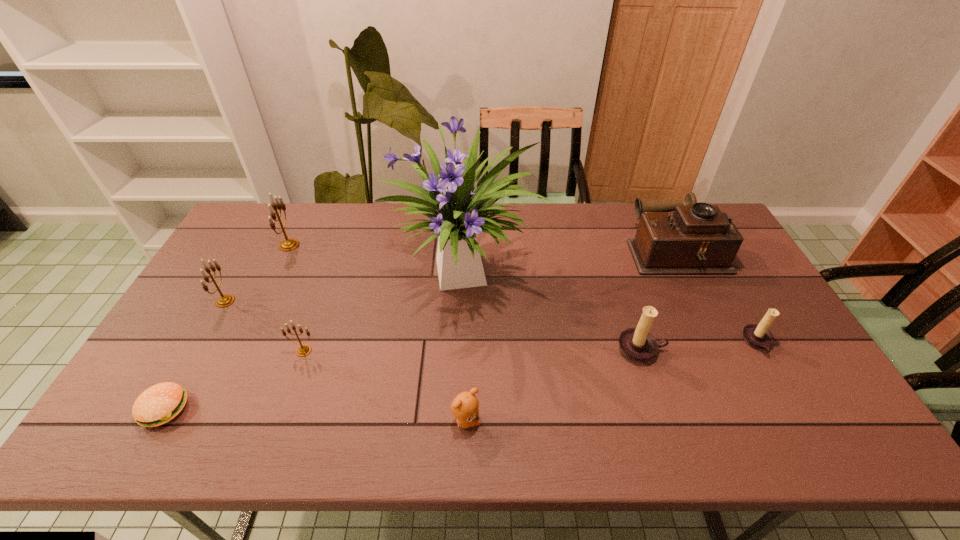
The image size is (960, 540). Identify the location of the right brown candle holder. (757, 336).

Where is `the nearest gold candelabrum`? The image size is (960, 540). the nearest gold candelabrum is located at coordinates (303, 350).

I want to click on the smallest gold candelabrum, so click(x=303, y=350).

Locate an element on the screen. This screenshot has height=540, width=960. brown teddy bear is located at coordinates (465, 407).

Where is `brown patty`? The height and width of the screenshot is (540, 960). brown patty is located at coordinates (159, 404).

Locate an element on the screen. The image size is (960, 540). the shortest object is located at coordinates (159, 404).

What are the coordinates of `free space located 0.080m on the front of the green flower arrangement` in the screenshot? It's located at (464, 357).

Where is `vacant space located 0.230m on the front of the farthest candelabrum`? vacant space located 0.230m on the front of the farthest candelabrum is located at coordinates (258, 309).

The image size is (960, 540). I want to click on vacant space located 0.260m on the horn of the phonograph_record, so click(552, 251).

The height and width of the screenshot is (540, 960). I want to click on free space located on the horn of the phonograph_record, so click(x=531, y=251).